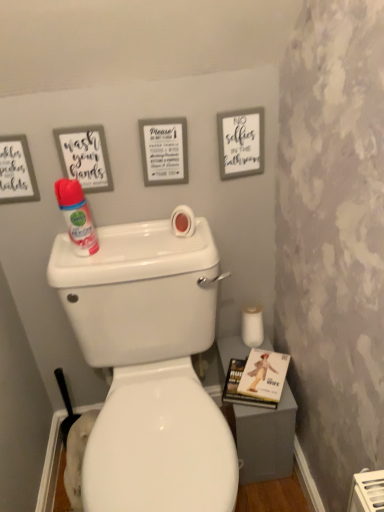
Locate an element on the screen. Image resolution: width=384 pixels, height=512 pixels. free space to the right of matte pink spray bottle at left is located at coordinates (154, 255).